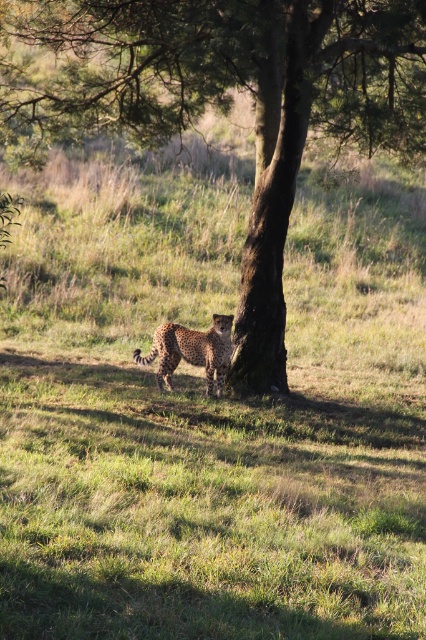
Who is lower down, brown rough tree at center or spotted fur cheetah at center?

Positioned lower is spotted fur cheetah at center.

Between brown rough tree at center and spotted fur cheetah at center, which one has less height?

With less height is spotted fur cheetah at center.

Does point (80, 115) come behind point (215, 388)?

Yes, point (80, 115) is behind point (215, 388).

The image size is (426, 640). What are the coordinates of `brown rough tree at center` in the screenshot? It's located at (227, 100).